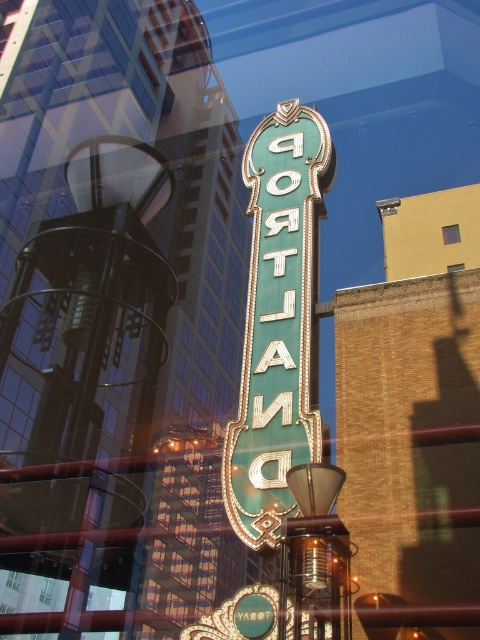
In the scene shown: You are a delivery person trying to determine the best route to the green metallic sign at center. You notice a blue glass window at center in the same area. Which object would you need to navigate around first if approaching from the left side of the image?

The green metallic sign at center is larger in size than the blue glass window at center, so you would need to navigate around the green metallic sign at center first as it occupies more space in the path.

Consider the image. You are standing in front of a reflective surface and see the green metallic sign at center and the blue glass window at center. Which object appears taller in the reflection?

The green metallic sign at center appears taller than the blue glass window at center in the reflection.

Looking at this image, you are standing in front of a reflective surface and see both the green metallic sign at center and the blue glass window at center. Which object is positioned to the left when viewed from your perspective?

The green metallic sign at center is positioned to the left of the blue glass window at center.